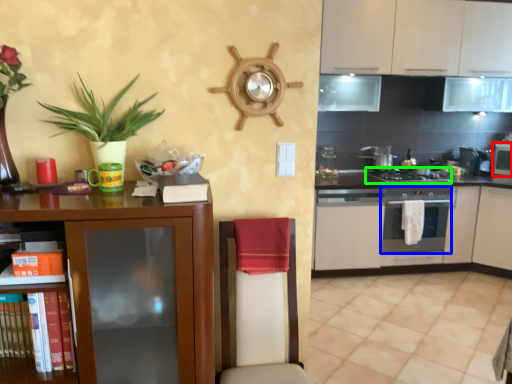
Question: Which is nearer to the appliance (highlighted by a red box)? kitchen appliance (highlighted by a blue box) or gas stove (highlighted by a green box).

Choices:
 (A) kitchen appliance
 (B) gas stove

Answer: (B)